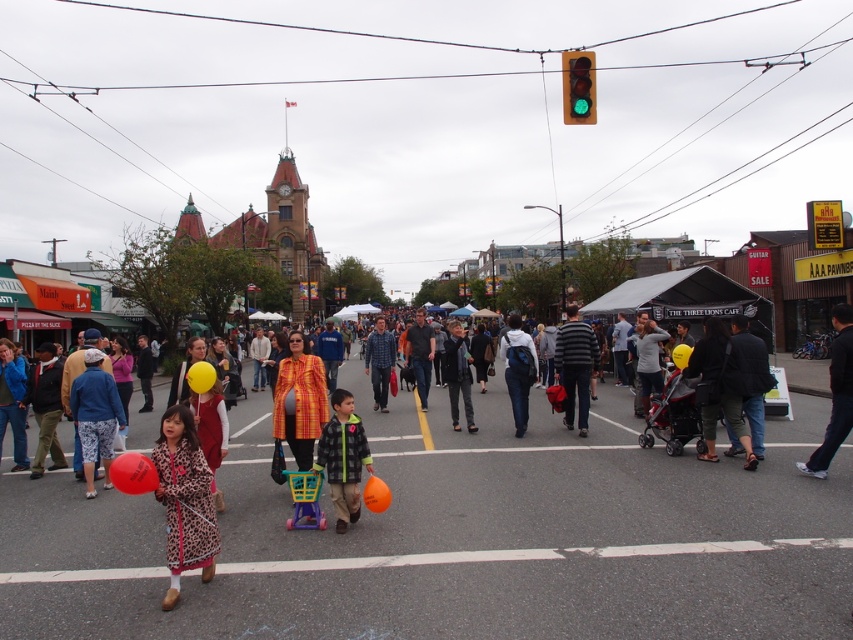
Question: Does black smooth pants at lower right come in front of dark gray pants at lower right?

Choices:
 (A) yes
 (B) no

Answer: (A)

Question: Among these points, which one is farthest from the camera?

Choices:
 (A) (137, 477)
 (B) (358, 458)

Answer: (B)

Question: Which of the following is the closest to the observer?

Choices:
 (A) (514, 346)
 (B) (90, 372)
 (C) (584, 326)
 (D) (686, 353)

Answer: (B)

Question: Where is leopard print coat at lower left located in relation to green glass traffic light at upper center in the image?

Choices:
 (A) below
 (B) above

Answer: (A)

Question: Which point is farther from the camera taking this photo?

Choices:
 (A) (204, 374)
 (B) (685, 353)

Answer: (B)

Question: Is striped cotton sweater at center positioned at the back of yellow rubber balloon at center?

Choices:
 (A) yes
 (B) no

Answer: (A)